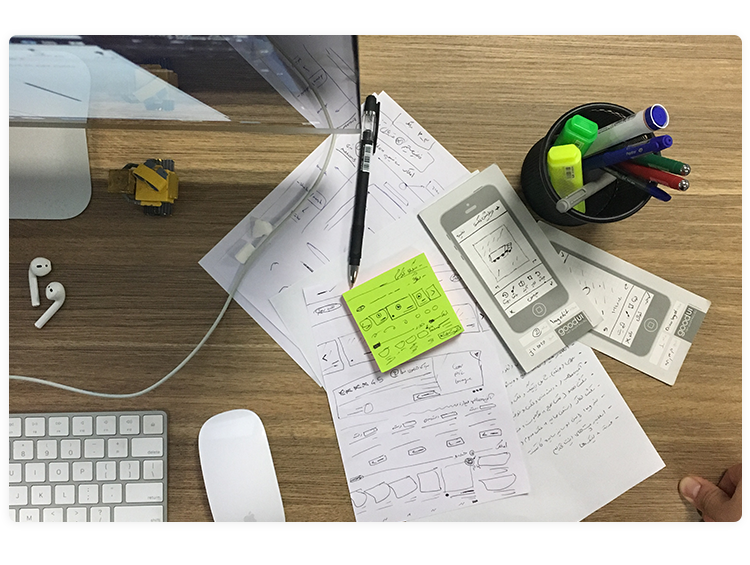
Find the location of a particular element. keyboard is located at coordinates (97, 470).